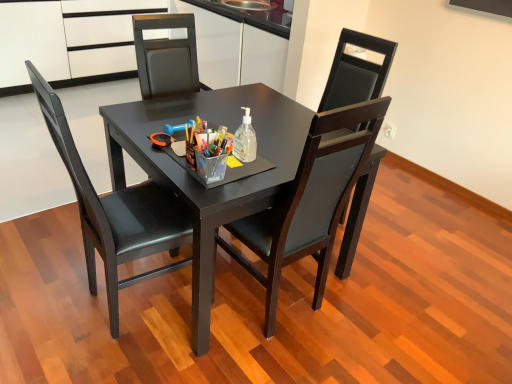
Identify the location of clear plastic bottle at center. pos(245,139).

Measure the distance between point [262,254] and camera.

1.69 meters.

This screenshot has height=384, width=512. What do you see at coordinates (310, 201) in the screenshot? I see `matte black chair at center, placed as the 1th chair when sorted from right to left` at bounding box center [310, 201].

The width and height of the screenshot is (512, 384). What are the coordinates of `matte black chair at center, which ranks as the 1th chair in left-to-right order` in the screenshot? It's located at (116, 212).

What do you see at coordinates (69, 38) in the screenshot? This screenshot has width=512, height=384. I see `white matte cabinet at upper left` at bounding box center [69, 38].

Identify the location of clear plastic bottle at center. (245, 139).

Relative to white matte cabinet at upper left, is matte black table at center in front or behind?

Visually, matte black table at center is located in front of white matte cabinet at upper left.

Is matte black table at center taller or shorter than white matte cabinet at upper left?

Clearly, matte black table at center is shorter compared to white matte cabinet at upper left.

Is point (281, 142) less distant than point (100, 49)?

Yes, point (281, 142) is closer to viewer.

Considering the relative sizes of matte black chair at center, marked as the 2th chair in a right-to-left arrangement, and matte black table at center in the image provided, is matte black chair at center, marked as the 2th chair in a right-to-left arrangement, thinner than matte black table at center?

Indeed, matte black chair at center, marked as the 2th chair in a right-to-left arrangement, has a lesser width compared to matte black table at center.

Is matte black chair at center, which ranks as the 1th chair in left-to-right order, closer to camera compared to matte black table at center?

Yes, it is.

Between matte black chair at center, which ranks as the 1th chair in left-to-right order, and matte black table at center, which one has more height?

matte black chair at center, which ranks as the 1th chair in left-to-right order.

Based on the photo, is matte black chair at center, which ranks as the 1th chair in left-to-right order, facing towards matte black table at center?

Yes.

Considering the sizes of objects matte black table at center and matte black chair at center, which is the 2th chair from left to right, in the image provided, who is smaller, matte black table at center or matte black chair at center, which is the 2th chair from left to right,?

Smaller between the two is matte black chair at center, which is the 2th chair from left to right.

Does matte black table at center have a greater height compared to matte black chair at center, which is the 2th chair from left to right?

No.

Is matte black table at center positioned far away from matte black chair at center, placed as the 1th chair when sorted from right to left?

They are positioned close to each other.

Identify the location of chair that is the 2nd one above the matte black table at center (from a real-world perspective). The width and height of the screenshot is (512, 384). (310, 201).

From a real-world perspective, which chair is the 2nd one above the white matte cabinet at upper left? Please provide its 2D coordinates.

[(310, 201)]

Between matte black chair at center, which is the 2th chair from left to right, and white matte cabinet at upper left, which one has smaller size?

matte black chair at center, which is the 2th chair from left to right.

Is matte black chair at center, which is the 2th chair from left to right, at the left side of white matte cabinet at upper left?

In fact, matte black chair at center, which is the 2th chair from left to right, is to the right of white matte cabinet at upper left.

Consider the image. Which point is more forward, (135, 192) or (312, 209)?

Point (312, 209)

How distant is matte black chair at center, marked as the 2th chair in a right-to-left arrangement, from matte black chair at center, which is the 2th chair from left to right?

matte black chair at center, marked as the 2th chair in a right-to-left arrangement, and matte black chair at center, which is the 2th chair from left to right, are 19.94 inches apart from each other.

From the image's perspective, is matte black chair at center, which ranks as the 1th chair in left-to-right order, above or below matte black chair at center, placed as the 1th chair when sorted from right to left?

Based on their image positions, matte black chair at center, which ranks as the 1th chair in left-to-right order, is located above matte black chair at center, placed as the 1th chair when sorted from right to left.

Based on the photo, is matte black chair at center, placed as the 1th chair when sorted from right to left, completely or partially inside matte black chair at center, which ranks as the 1th chair in left-to-right order?

Actually, matte black chair at center, placed as the 1th chair when sorted from right to left, is outside matte black chair at center, which ranks as the 1th chair in left-to-right order.

From the image's perspective, is clear plastic bottle at center positioned above or below matte black chair at center, marked as the 2th chair in a right-to-left arrangement?

From the image's perspective, clear plastic bottle at center appears above matte black chair at center, marked as the 2th chair in a right-to-left arrangement.

Can you tell me how much clear plastic bottle at center and matte black chair at center, which ranks as the 1th chair in left-to-right order, differ in facing direction?

3.31 degrees separate the facing orientations of clear plastic bottle at center and matte black chair at center, which ranks as the 1th chair in left-to-right order.

From the image's perspective, count 1st chairs downward from the clear plastic bottle at center and point to it. Please provide its 2D coordinates.

[(116, 212)]

Is clear plastic bottle at center inside the boundaries of matte black chair at center, which ranks as the 1th chair in left-to-right order, or outside?

clear plastic bottle at center is not enclosed by matte black chair at center, which ranks as the 1th chair in left-to-right order.

Based on the photo, who is smaller, white matte cabinet at upper left or matte black chair at center, marked as the 2th chair in a right-to-left arrangement?

matte black chair at center, marked as the 2th chair in a right-to-left arrangement, is smaller.

Is point (9, 23) closer or farther from the camera than point (158, 235)?

Point (9, 23) appears to be farther away from the viewer than point (158, 235).

Is white matte cabinet at upper left facing away from matte black chair at center, which ranks as the 1th chair in left-to-right order?

That's not correct — white matte cabinet at upper left is not looking away from matte black chair at center, which ranks as the 1th chair in left-to-right order.

The height and width of the screenshot is (384, 512). Find the location of `cabinetry above the matte black table at center (from a real-world perspective)`. cabinetry above the matte black table at center (from a real-world perspective) is located at coordinates (69, 38).

Identify the location of chair on the left of matte black table at center. This screenshot has width=512, height=384. (116, 212).

Estimate the real-world distances between objects in this image. Which object is further from clear plastic bottle at center, matte black chair at center, marked as the 2th chair in a right-to-left arrangement, or white matte cabinet at upper left?

white matte cabinet at upper left.

Based on their spatial positions, is matte black table at center or matte black chair at center, placed as the 1th chair when sorted from right to left, further from matte black chair at center, which ranks as the 1th chair in left-to-right order?

Based on the image, matte black chair at center, placed as the 1th chair when sorted from right to left, appears to be further to matte black chair at center, which ranks as the 1th chair in left-to-right order.

In the scene shown: Based on their spatial positions, is white matte cabinet at upper left or clear plastic bottle at center further from matte black chair at center, which is the 2th chair from left to right?

Among the two, white matte cabinet at upper left is located further to matte black chair at center, which is the 2th chair from left to right.

Considering their positions, is matte black chair at center, placed as the 1th chair when sorted from right to left, positioned closer to matte black chair at center, which ranks as the 1th chair in left-to-right order, than matte black table at center?

Among the two, matte black table at center is located nearer to matte black chair at center, which ranks as the 1th chair in left-to-right order.

Estimate the real-world distances between objects in this image. Which object is closer to matte black table at center, white matte cabinet at upper left or matte black chair at center, marked as the 2th chair in a right-to-left arrangement?

The object closer to matte black table at center is matte black chair at center, marked as the 2th chair in a right-to-left arrangement.

From the image, which object appears to be nearer to matte black chair at center, marked as the 2th chair in a right-to-left arrangement, white matte cabinet at upper left or matte black table at center?

matte black table at center.

Based on the photo, when comparing their distances from white matte cabinet at upper left, does clear plastic bottle at center or matte black table at center seem further?

clear plastic bottle at center is further to white matte cabinet at upper left.

Considering their positions, is matte black chair at center, which is the 2th chair from left to right, positioned further to white matte cabinet at upper left than matte black chair at center, which ranks as the 1th chair in left-to-right order?

matte black chair at center, which is the 2th chair from left to right, is further to white matte cabinet at upper left.

This screenshot has height=384, width=512. I want to click on round table located between matte black chair at center, which ranks as the 1th chair in left-to-right order, and white matte cabinet at upper left in the depth direction, so click(199, 183).

Locate an element on the screen. bottle located between matte black chair at center, marked as the 2th chair in a right-to-left arrangement, and white matte cabinet at upper left in the depth direction is located at coordinates (245, 139).

This screenshot has width=512, height=384. What are the coordinates of `round table between matte black chair at center, which ranks as the 1th chair in left-to-right order, and matte black chair at center, which is the 2th chair from left to right` in the screenshot? It's located at (199, 183).

I want to click on round table situated between matte black chair at center, which ranks as the 1th chair in left-to-right order, and clear plastic bottle at center from left to right, so click(x=199, y=183).